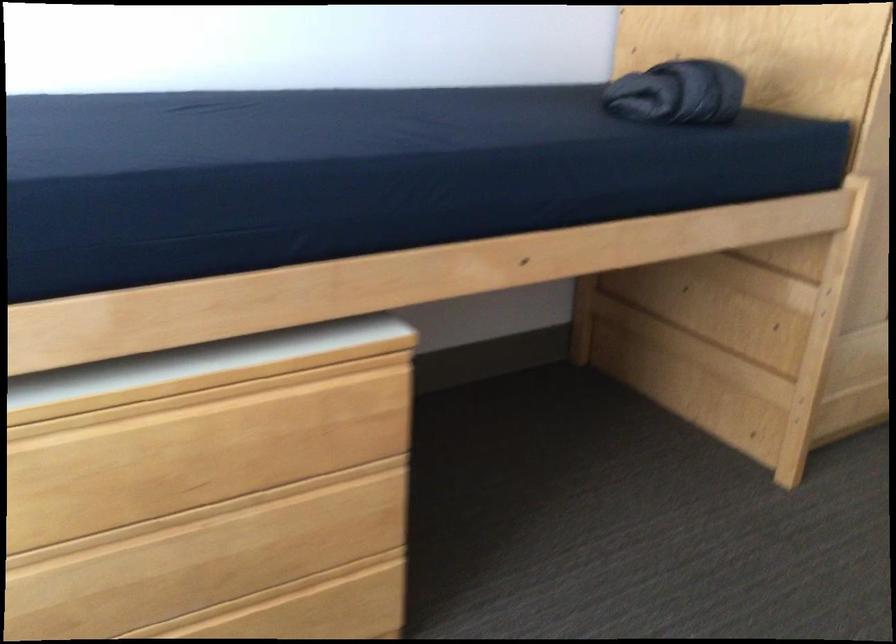
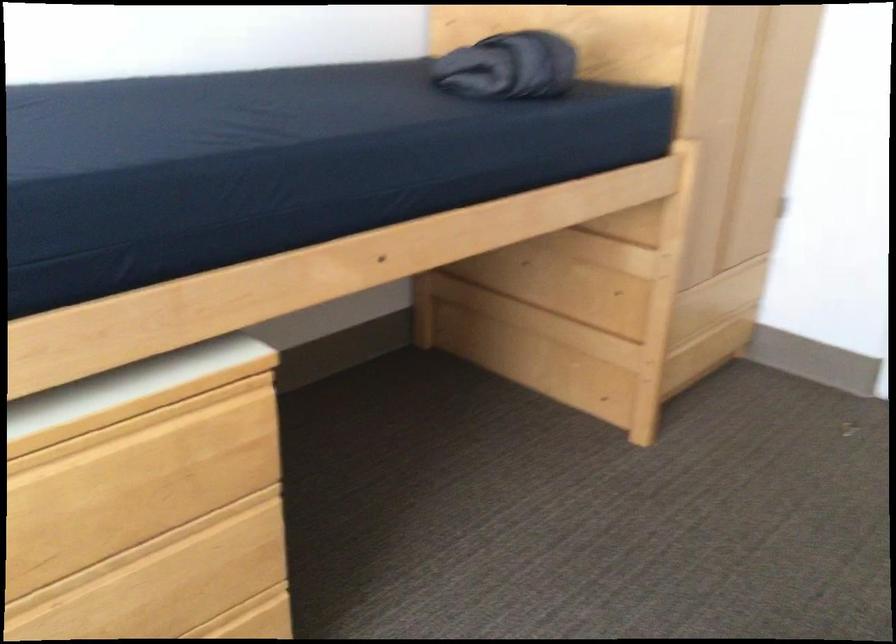
In the second image, find the point that corresponds to point 280,491 in the first image.

(135, 554)